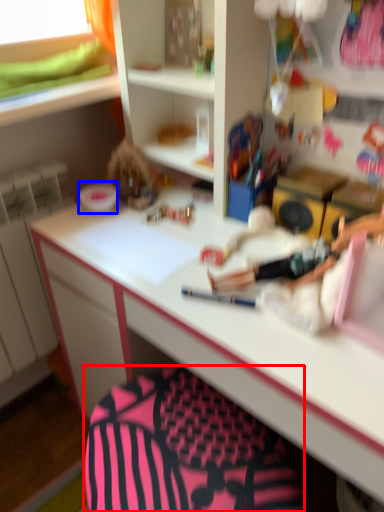
Question: Which object appears closest to the camera in this image, swivel chair (highlighted by a red box) or stationery (highlighted by a blue box)?

Choices:
 (A) swivel chair
 (B) stationery

Answer: (A)